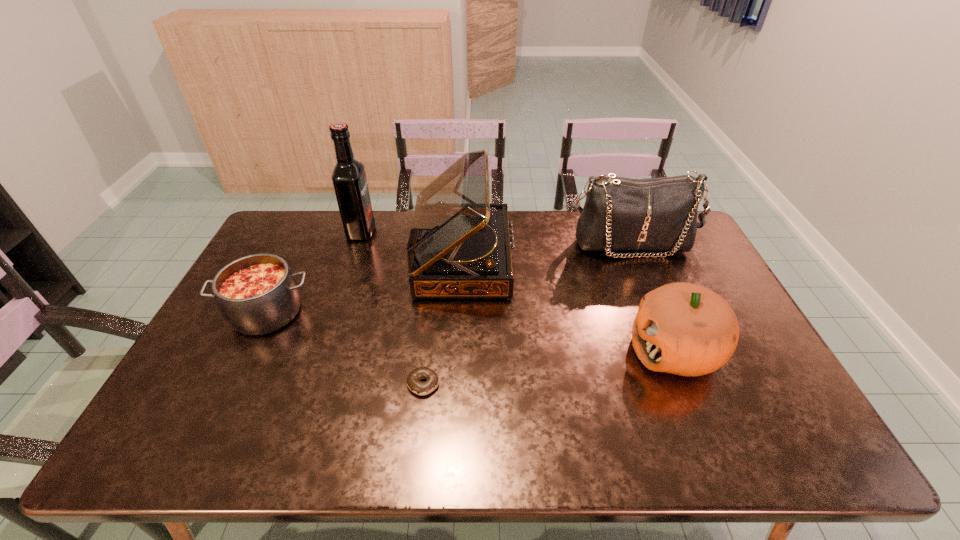
You are a GUI agent. You are given a task and a screenshot of the screen. Output one action in this format:
    pyautogui.click(x=<x>, y=<y>)
    Task: Click on the liquor
    This screenshot has width=960, height=540.
    Given the screenshot: What is the action you would take?
    pyautogui.click(x=349, y=180)

You are a GUI agent. You are given a task and a screenshot of the screen. Output one action in this format:
    pyautogui.click(x=<x>, y=<y>)
    Task: Click on the fifth object from right to left
    
    Given the screenshot: What is the action you would take?
    pyautogui.click(x=349, y=180)

In order to click on record player in this screenshot , I will do `click(459, 246)`.

I want to click on handbag, so click(620, 214).

I want to click on the fourth tallest object, so click(x=686, y=329).

You are a GUI agent. You are given a task and a screenshot of the screen. Output one action in this format:
    pyautogui.click(x=<x>, y=<y>)
    Task: Click on the fifth tallest object
    This screenshot has height=540, width=960.
    Given the screenshot: What is the action you would take?
    coord(258,294)

This screenshot has width=960, height=540. Identify the location of casserole. (258, 294).

Where is `doughnut`? The width and height of the screenshot is (960, 540). doughnut is located at coordinates (414, 384).

This screenshot has width=960, height=540. Identify the location of vacant space located on the front-facing side of the liquor. (468, 232).

Locate an element on the screen. vacant area situated on the front-facing side of the record player is located at coordinates (582, 258).